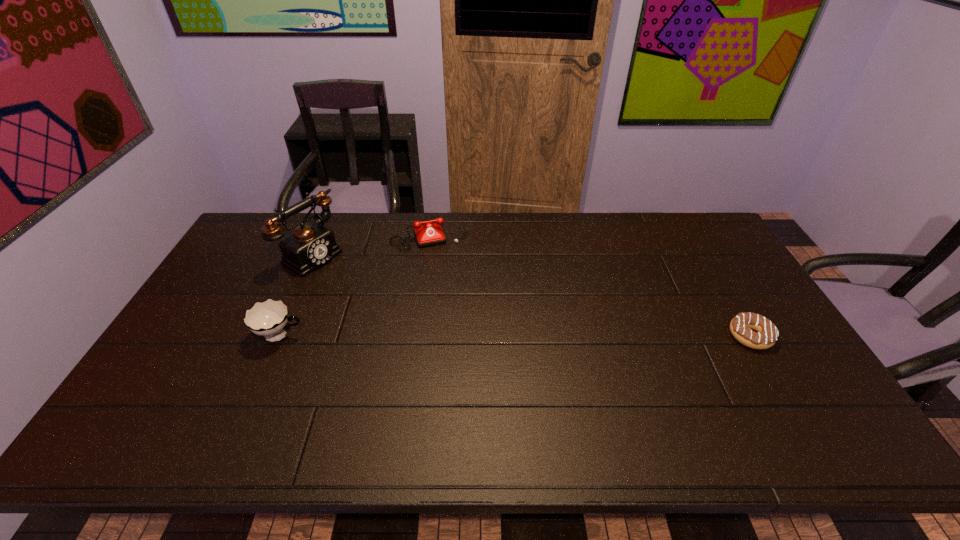
At what (x,y) coordinates should I click in order to perform the action: click on free space located 0.350m on the dial of the second shortest object. Please return your answer as a coordinate pair (x, y). This screenshot has height=540, width=960. Looking at the image, I should click on (464, 323).

What are the coordinates of `vacant space located 0.140m on the dial of the second shortest object` in the screenshot? It's located at (447, 276).

At what (x,y) coordinates should I click in order to perform the action: click on free space located on the front of the left telephone at the rotary dial. Please return your answer as a coordinate pair (x, y). Looking at the image, I should click on (360, 286).

Locate an element on the screen. This screenshot has width=960, height=540. free space located on the front of the left telephone at the rotary dial is located at coordinates (402, 310).

Locate an element on the screen. The width and height of the screenshot is (960, 540). free space located 0.370m on the front of the left telephone at the rotary dial is located at coordinates (x=415, y=318).

Identify the location of object present at the right edge. (766, 335).

This screenshot has width=960, height=540. In order to click on free spot at the far edge of the desktop in this screenshot , I will do `click(447, 245)`.

The height and width of the screenshot is (540, 960). In the image, there is a desktop. What are the coordinates of `vacant area at the near edge` in the screenshot? It's located at (311, 390).

In order to click on vacant area at the left edge of the desktop in this screenshot , I will do `click(201, 353)`.

The width and height of the screenshot is (960, 540). In the image, there is a desktop. What are the coordinates of `vacant space at the right edge` in the screenshot? It's located at (726, 272).